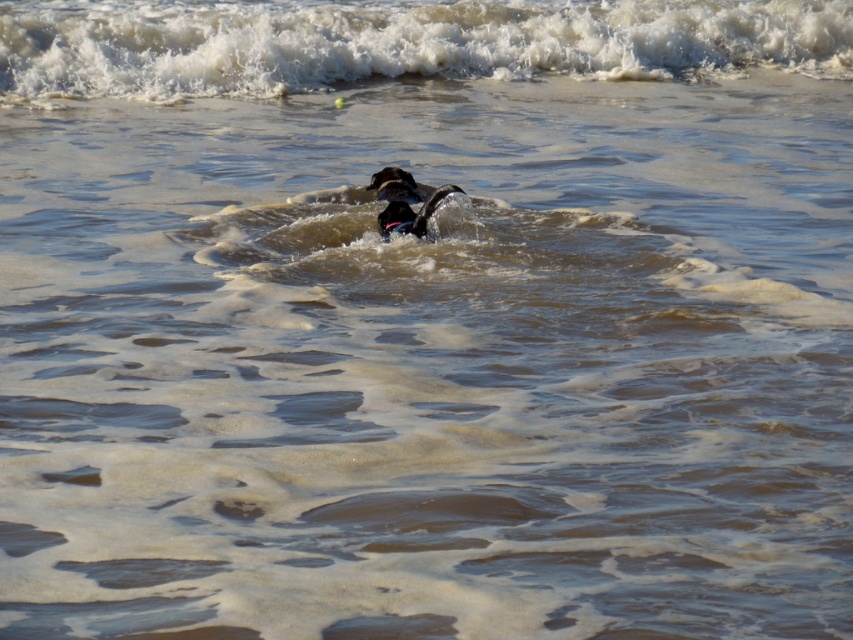
Which is below, shiny black dog at center or black matte dog at center?

Positioned lower is shiny black dog at center.

Does point (389, 202) lie behind point (398, 196)?

No.

You are a GUI agent. You are given a task and a screenshot of the screen. Output one action in this format:
    pyautogui.click(x=<x>, y=<y>)
    Task: Click on the shiny black dog at center
    
    Given the screenshot: What is the action you would take?
    pyautogui.click(x=412, y=212)

Who is taller, white frothy wave at upper center or black matte dog at center?

Standing taller between the two is black matte dog at center.

Can you confirm if white frothy wave at upper center is taller than black matte dog at center?

In fact, white frothy wave at upper center may be shorter than black matte dog at center.

Who is more distant from viewer, (811, 49) or (418, 184)?

Point (811, 49)

Identify the location of white frothy wave at upper center. The height and width of the screenshot is (640, 853). (399, 44).

Between point (254, 77) and point (454, 184), which one is positioned in front?

Point (454, 184)

Between white frothy wave at upper center and shiny black dog at center, which one is positioned lower?

shiny black dog at center is below.

Does point (538, 12) come farther from viewer compared to point (381, 232)?

Yes, it is behind point (381, 232).

At what (x,y) coordinates should I click in order to perform the action: click on white frothy wave at upper center. Please return your answer as a coordinate pair (x, y). The height and width of the screenshot is (640, 853). Looking at the image, I should click on (399, 44).